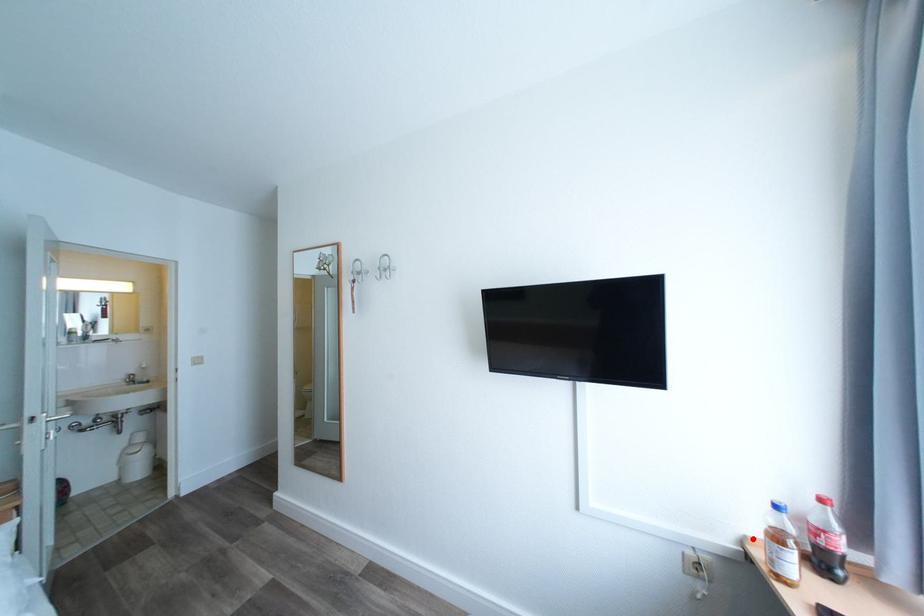
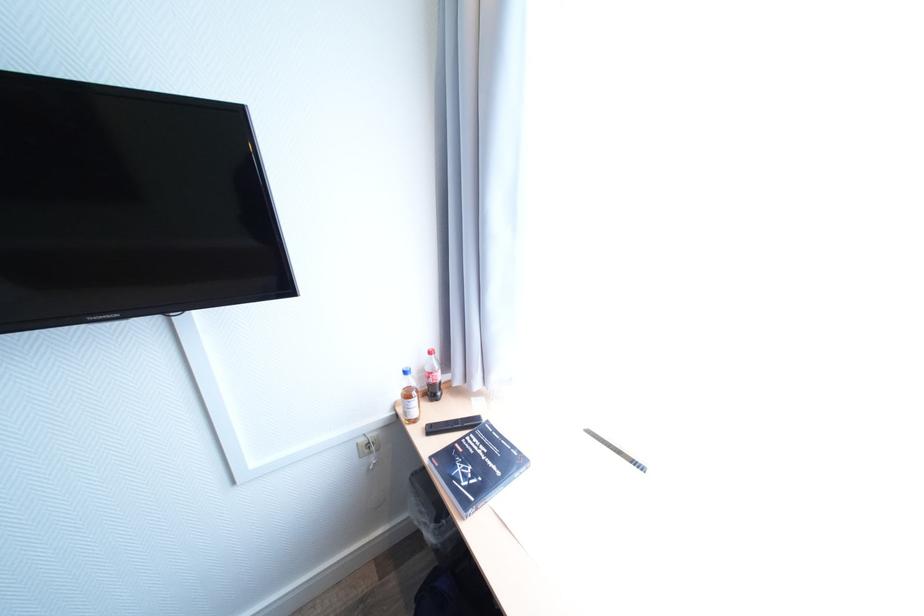
Question: I am providing you with two images of the same scene from different viewpoints. In image1, a red point is highlighted. Considering the same 3D point in image2, which of the following is correct?

Choices:
 (A) It is closer
 (B) It is farther

Answer: (B)